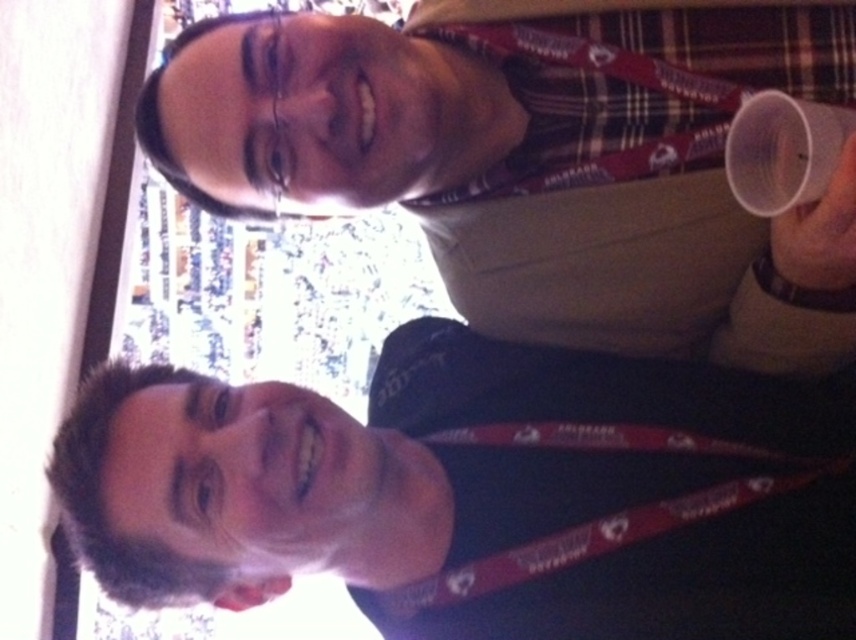
Question: Is white matte face at lower left bigger than transparent plastic cup at upper right?

Choices:
 (A) no
 (B) yes

Answer: (B)

Question: Which object is positioned closest to the transparent plastic cup at upper right?

Choices:
 (A) white matte face at lower left
 (B) matte plastic cup at upper right

Answer: (B)

Question: Which of the following is the farthest from the observer?

Choices:
 (A) (791, 173)
 (B) (461, 499)

Answer: (B)

Question: Which point is closer to the camera?

Choices:
 (A) transparent plastic cup at upper right
 (B) matte plastic cup at upper right

Answer: (A)

Question: Does white matte face at lower left have a smaller size compared to transparent plastic cup at upper right?

Choices:
 (A) yes
 (B) no

Answer: (B)

Question: Does white matte face at lower left come behind matte plastic cup at upper right?

Choices:
 (A) yes
 (B) no

Answer: (A)